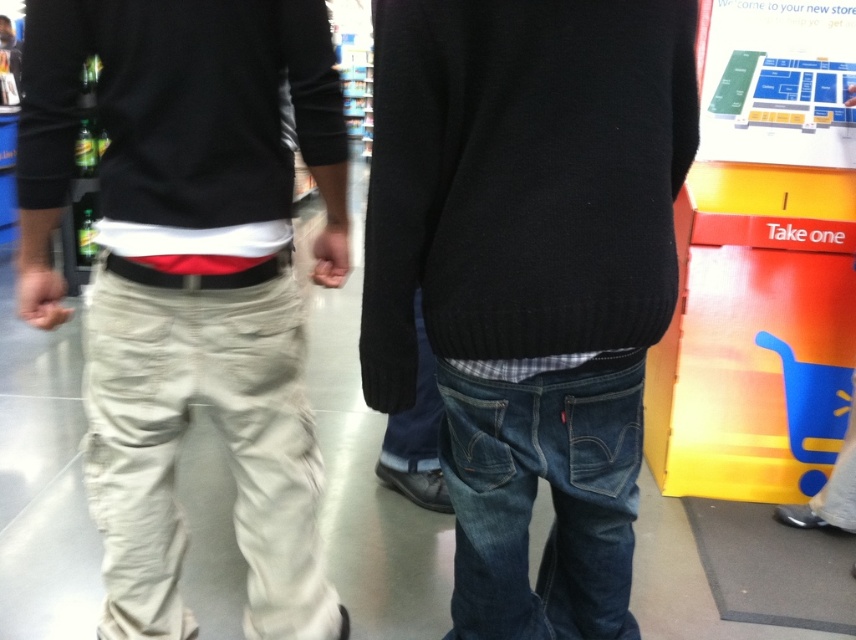
You are a store employee who needs to place a new sign that is 1.2 meters tall between the denim jeans at center and the black leather sweatshirt at left. Can the space between them accommodate the sign vertically?

The denim jeans at center is taller than the black leather sweatshirt at left, but the height comparison between the two objects does not provide information about the vertical space between them. The sign may or may not fit depending on the actual vertical clearance, which isnecessary to determine.

You are a store employee who needs to place a 16 inch wide decorative box between the denim jeans at center and the black leather sweatshirt at left. Can the box fit between them without overlapping either item?

The denim jeans at center and black leather sweatshirt at left are 17.32 inches apart from each other. Since the box is 16 inches wide, it can fit between them as there is enough space.

You are standing in a retail store and need to reach a point that is exactly 1.27 meters away from your current position. The point is located at coordinates point (269, 323). Can you confirm if this point is within your reach if you extend your arm fully, which has a maximum reach of 1.3 meters?

The distance of point (269, 323) from camera is 1.27 meters, so yes, the point is within reach since 1.27 meters is less than the arm reach of 1.3 meters.